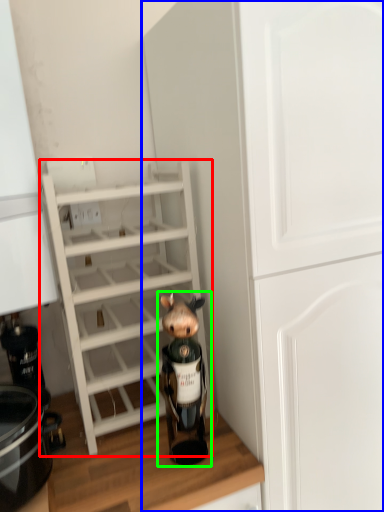
Question: Which object is positioned closest to shelf (highlighted by a red box)? Select from cabinetry (highlighted by a blue box) and figurine (highlighted by a green box).

Choices:
 (A) cabinetry
 (B) figurine

Answer: (B)